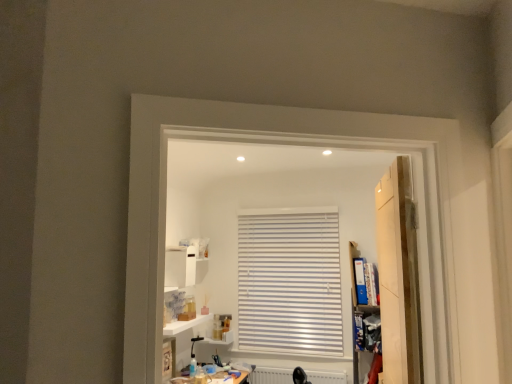
In order to face wooden door at right, should I rotate leftwards or rightwards?

To face it directly, rotate right by 17.945 degrees.

Locate an element on the screen. white glossy shelf at lower center is located at coordinates (185, 324).

Describe the element at coordinates (271, 375) in the screenshot. I see `white matte radiator at lower center` at that location.

Where is `wooden door at right`? The image size is (512, 384). wooden door at right is located at coordinates (398, 276).

Is white matte radiator at lower center taller or shorter than wooden door at right?

Clearly, white matte radiator at lower center is shorter compared to wooden door at right.

Can you confirm if white matte radiator at lower center is thinner than wooden door at right?

Yes.

In the image, is white matte radiator at lower center on the left side or the right side of wooden door at right?

Based on their positions, white matte radiator at lower center is located to the left of wooden door at right.

How many degrees apart are the facing directions of wooden door at right and white matte radiator at lower center?

wooden door at right and white matte radiator at lower center are facing 84.3 degrees away from each other.

Is wooden door at right situated inside white matte radiator at lower center or outside?

wooden door at right is outside white matte radiator at lower center.

Considering the sizes of objects wooden door at right and white matte radiator at lower center in the image provided, who is wider, wooden door at right or white matte radiator at lower center?

wooden door at right.

Considering the sizes of wooden door at right and white matte radiator at lower center in the image, is wooden door at right taller or shorter than white matte radiator at lower center?

Considering their sizes, wooden door at right has more height than white matte radiator at lower center.

Which object is thinner, white glossy shelf at lower center or white glossy cabinet at upper center?

With smaller width is white glossy cabinet at upper center.

Is white glossy shelf at lower center facing towards white glossy cabinet at upper center?

No.

Can you tell me how much white glossy shelf at lower center and white glossy cabinet at upper center differ in facing direction?

There is a 90.3-degree angle between the facing directions of white glossy shelf at lower center and white glossy cabinet at upper center.

From the image's perspective, would you say white glossy shelf at lower center is positioned over wooden door at right?

No, from the image's perspective, white glossy shelf at lower center is not on top of wooden door at right.

Can wooden door at right be found inside white glossy shelf at lower center?

No, wooden door at right is located outside of white glossy shelf at lower center.

Is white glossy shelf at lower center in front of or behind wooden door at right in the image?

Visually, white glossy shelf at lower center is located behind wooden door at right.

From a real-world perspective, is white glossy shelf at lower center physically below wooden door at right?

Correct, in the physical world, white glossy shelf at lower center is lower than wooden door at right.

The image size is (512, 384). Identify the location of window sill below the white glossy cabinet at upper center (from the image's perspective). (185, 324).

Considering the relative sizes of white glossy cabinet at upper center and white glossy shelf at lower center in the image provided, is white glossy cabinet at upper center wider than white glossy shelf at lower center?

In fact, white glossy cabinet at upper center might be narrower than white glossy shelf at lower center.

Can you see white glossy cabinet at upper center touching white glossy shelf at lower center?

No, white glossy cabinet at upper center is not touching white glossy shelf at lower center.

Which object is positioned more to the right, white glossy cabinet at upper center or white glossy shelf at lower center?

Positioned to the right is white glossy shelf at lower center.

Can you confirm if white matte radiator at lower center is smaller than white glossy shelf at lower center?

No, white matte radiator at lower center is not smaller than white glossy shelf at lower center.

Is white matte radiator at lower center far from white glossy shelf at lower center?

No, there isn't a large distance between white matte radiator at lower center and white glossy shelf at lower center.

Looking at this image, is white matte radiator at lower center taller or shorter than white glossy shelf at lower center?

Considering their sizes, white matte radiator at lower center has more height than white glossy shelf at lower center.

In the scene shown: Is white matte radiator at lower center turned away from white glossy shelf at lower center?

white matte radiator at lower center does not have its back to white glossy shelf at lower center.

Would you say white glossy cabinet at upper center is a long distance from wooden door at right?

Absolutely, white glossy cabinet at upper center is distant from wooden door at right.

Between white glossy cabinet at upper center and wooden door at right, which one has less height?

Standing shorter between the two is white glossy cabinet at upper center.

Looking at this image, from a real-world perspective, is white glossy cabinet at upper center located beneath wooden door at right?

No, from a real-world perspective, white glossy cabinet at upper center is not under wooden door at right.

From the image's perspective, is white glossy cabinet at upper center above or below wooden door at right?

From the image's perspective, white glossy cabinet at upper center appears below wooden door at right.

Where is `door above the white matte radiator at lower center (from the image's perspective)`? The width and height of the screenshot is (512, 384). door above the white matte radiator at lower center (from the image's perspective) is located at coordinates (398, 276).

Identify the location of radiator lying below the wooden door at right (from the image's perspective). (271, 375).

Which object lies nearer to the anchor point white matte radiator at lower center, white glossy cabinet at upper center or white glossy shelf at lower center?

Among the two, white glossy shelf at lower center is located nearer to white matte radiator at lower center.

From the image, which object appears to be nearer to white glossy shelf at lower center, white matte radiator at lower center or white glossy cabinet at upper center?

Based on the image, white glossy cabinet at upper center appears to be nearer to white glossy shelf at lower center.

Based on their spatial positions, is white glossy cabinet at upper center or white matte radiator at lower center further from wooden door at right?

white glossy cabinet at upper center is further to wooden door at right.

Estimate the real-world distances between objects in this image. Which object is further from white glossy shelf at lower center, wooden door at right or white matte radiator at lower center?

wooden door at right.

Estimate the real-world distances between objects in this image. Which object is closer to wooden door at right, white matte radiator at lower center or white glossy cabinet at upper center?

white matte radiator at lower center is positioned closer to the anchor wooden door at right.

When comparing their distances from white matte radiator at lower center, does white glossy shelf at lower center or wooden door at right seem closer?

The object closer to white matte radiator at lower center is white glossy shelf at lower center.

Considering their positions, is white glossy cabinet at upper center positioned closer to white glossy shelf at lower center than wooden door at right?

Among the two, white glossy cabinet at upper center is located nearer to white glossy shelf at lower center.

Which object lies further to the anchor point wooden door at right, white matte radiator at lower center or white glossy shelf at lower center?

white matte radiator at lower center is positioned further to the anchor wooden door at right.

The image size is (512, 384). Identify the location of window sill between wooden door at right and white glossy cabinet at upper center in the front-back direction. (185, 324).

Identify the location of cabinet between wooden door at right and white matte radiator at lower center from front to back. The height and width of the screenshot is (384, 512). (184, 266).

You are a GUI agent. You are given a task and a screenshot of the screen. Output one action in this format:
    pyautogui.click(x=<x>, y=<y>)
    Task: Click on the window sill located between white glossy cabinet at upper center and white matte radiator at lower center in the left-right direction
    
    Given the screenshot: What is the action you would take?
    pyautogui.click(x=185, y=324)

This screenshot has height=384, width=512. In order to click on window sill between wooden door at right and white matte radiator at lower center along the z-axis in this screenshot , I will do `click(185, 324)`.